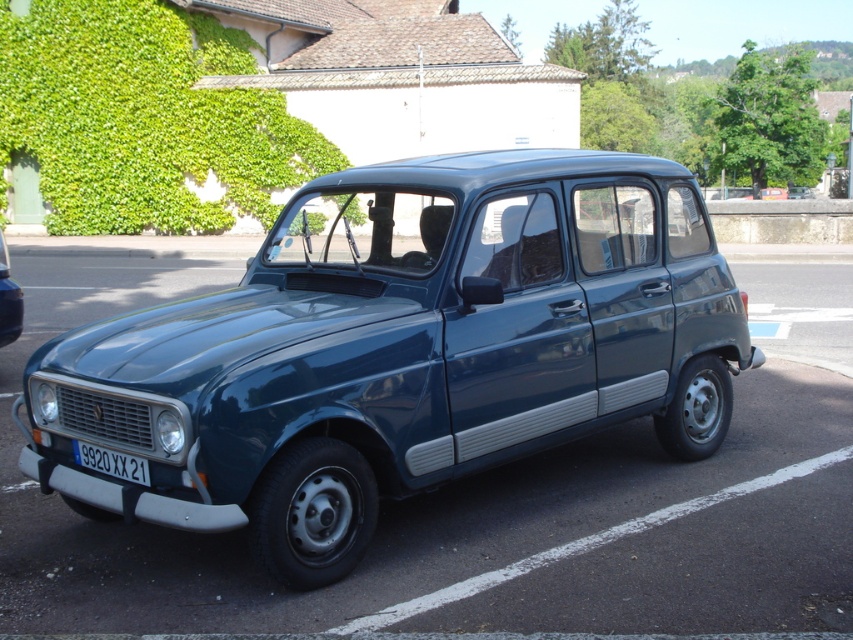
Question: Can you confirm if green leafy hedge at upper left is positioned above metallic blue car at lower left?

Choices:
 (A) no
 (B) yes

Answer: (B)

Question: Considering the real-world distances, which object is closest to the green leafy hedge at upper left?

Choices:
 (A) metallic blue car at lower left
 (B) metallic blue car at center

Answer: (A)

Question: Which point appears farthest from the camera in this image?

Choices:
 (A) (672, 300)
 (B) (119, 454)
 (C) (6, 81)
 (D) (10, 285)

Answer: (C)

Question: Is metallic blue car at center wider than green leafy hedge at upper left?

Choices:
 (A) no
 (B) yes

Answer: (A)

Question: Can you confirm if white plastic license plate at lower center is positioned above metallic blue car at lower left?

Choices:
 (A) yes
 (B) no

Answer: (B)

Question: Which object is positioned closest to the white plastic license plate at lower center?

Choices:
 (A) metallic blue car at lower left
 (B) metallic blue car at center
 (C) green leafy hedge at upper left

Answer: (B)